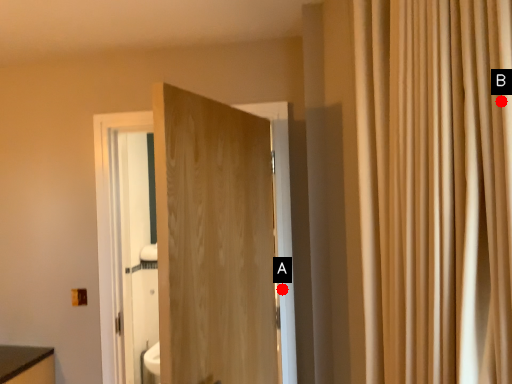
Question: Two points are circled on the image, labeled by A and B beside each circle. Which of the following is the farthest from the observer?

Choices:
 (A) A is further
 (B) B is further

Answer: (A)